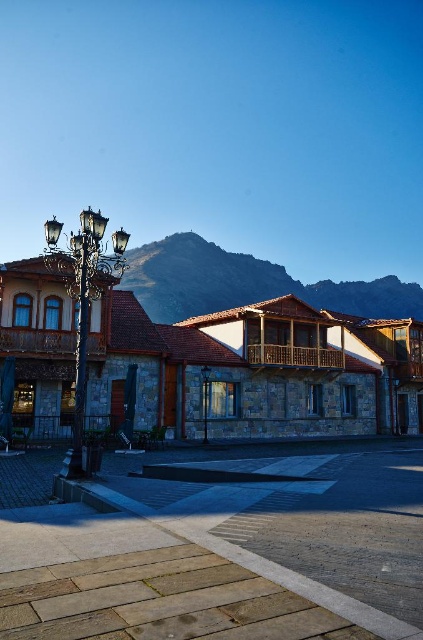
Question: Does rugged stone mountain at upper center have a smaller size compared to metallic streetlamp at left?

Choices:
 (A) no
 (B) yes

Answer: (A)

Question: Can you confirm if rugged stone mountain at upper center is wider than polished brass streetlamp at left?

Choices:
 (A) no
 (B) yes

Answer: (B)

Question: Is rugged stone mountain at upper center above polished brass streetlamp at left?

Choices:
 (A) no
 (B) yes

Answer: (B)

Question: Which point is farther to the camera?

Choices:
 (A) (203, 406)
 (B) (375, 307)
 (C) (77, 324)
 (D) (80, 228)

Answer: (B)

Question: Which point appears closest to the camera in this image?

Choices:
 (A) (71, 234)
 (B) (224, 268)

Answer: (A)

Question: Which point is farther to the camera?

Choices:
 (A) metallic streetlamp at left
 (B) polished brass streetlamp at left

Answer: (A)